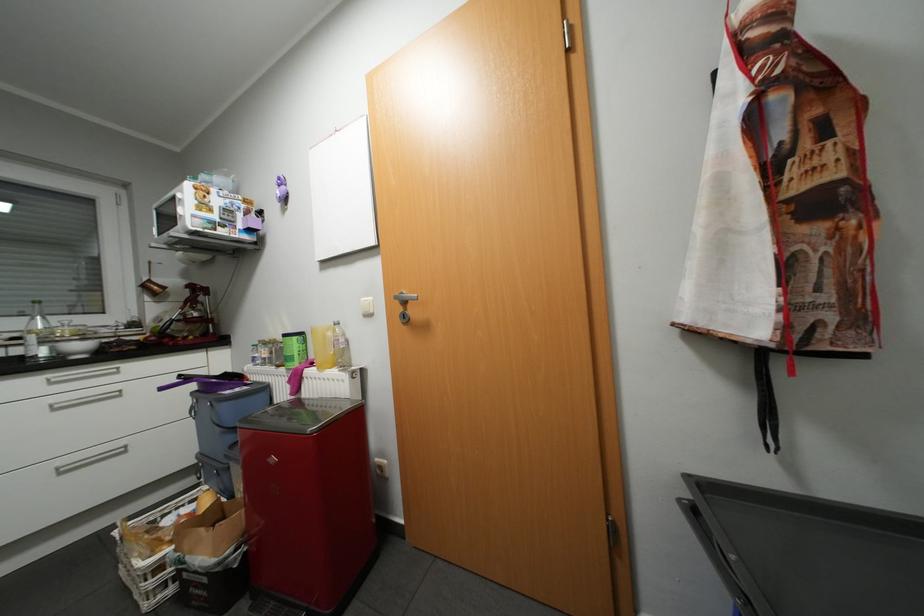
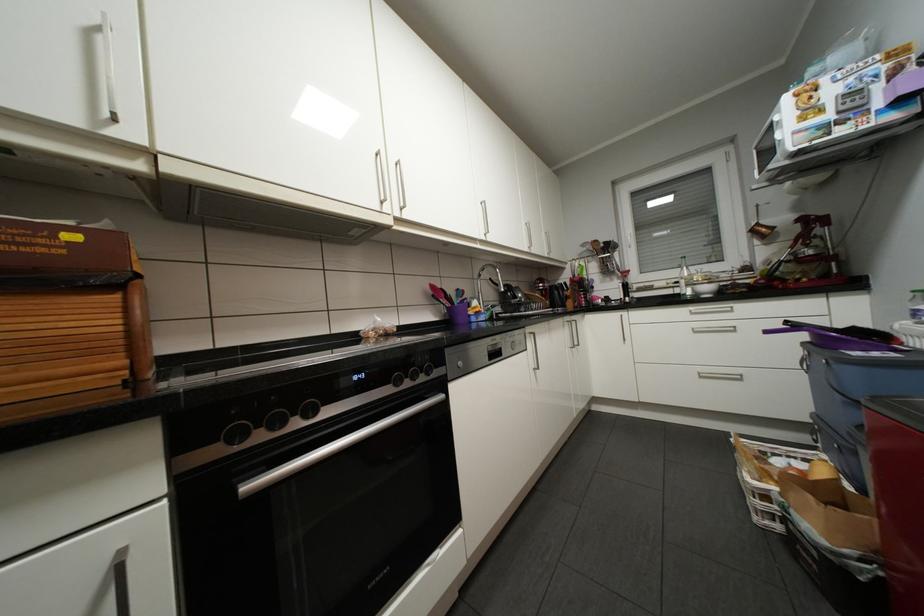
Question: Based on the continuous images, in which direction is the camera rotating? Reply with the corresponding letter.

Choices:
 (A) Left
 (B) Right
 (C) Up
 (D) Down

Answer: (A)